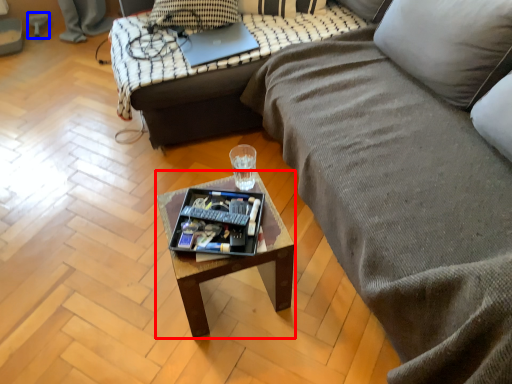
Question: Which point is further to the camera, coffee table (highlighted by a red box) or swivel chair (highlighted by a blue box)?

Choices:
 (A) coffee table
 (B) swivel chair

Answer: (B)